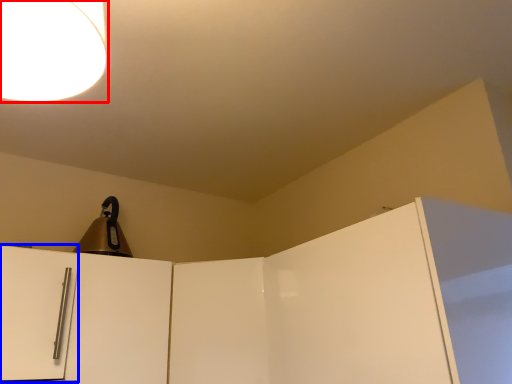
Question: Which of the following is the farthest to the observer, lamp (highlighted by a red box) or door (highlighted by a blue box)?

Choices:
 (A) lamp
 (B) door

Answer: (B)